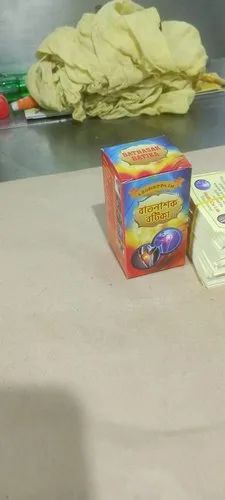
Identify the location of edge of beige and black  floor. Image resolution: width=225 pixels, height=500 pixels. (194, 151), (42, 174).